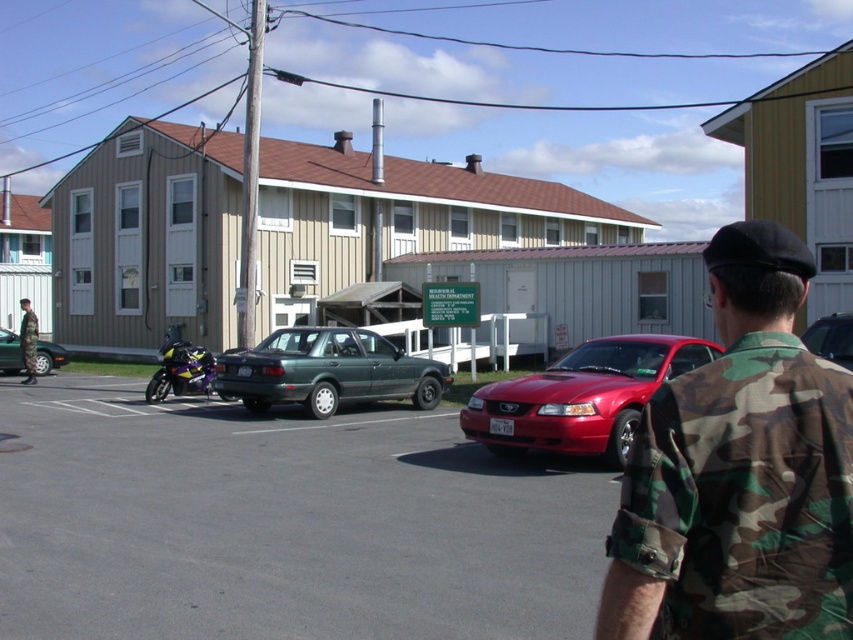
Does glossy red car at center have a lesser height compared to camouflage uniform at lower left?

Yes, glossy red car at center is shorter than camouflage uniform at lower left.

Between glossy red car at center and camouflage uniform at lower left, which one has less height?

With less height is glossy red car at center.

Is point (583, 408) positioned before point (24, 339)?

That is True.

You are a GUI agent. You are given a task and a screenshot of the screen. Output one action in this format:
    pyautogui.click(x=<x>, y=<y>)
    Task: Click on the glossy red car at center
    The image size is (853, 640).
    Given the screenshot: What is the action you would take?
    pyautogui.click(x=581, y=396)

Can you confirm if camo uniform at right is bigger than camouflage uniform at lower left?

Yes, camo uniform at right is bigger than camouflage uniform at lower left.

Describe the element at coordinates (740, 472) in the screenshot. Image resolution: width=853 pixels, height=640 pixels. I see `camo uniform at right` at that location.

This screenshot has width=853, height=640. Find the location of `camo uniform at right`. camo uniform at right is located at coordinates point(740,472).

In the scene shown: Between green matte sedan at center and metallic silver sedan at center, which one appears on the right side from the viewer's perspective?

metallic silver sedan at center

Does green matte sedan at center come behind metallic silver sedan at center?

Yes, green matte sedan at center is further from the viewer.

Identify the location of green matte sedan at center. The height and width of the screenshot is (640, 853). (328, 371).